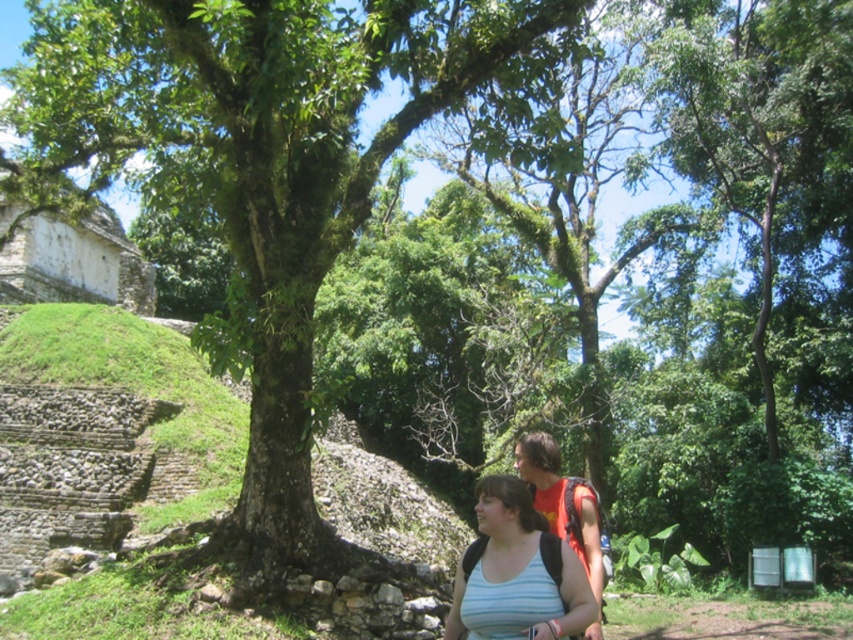
Does green leafy tree at center have a greater width compared to light blue striped tank top at center?

Indeed, green leafy tree at center has a greater width compared to light blue striped tank top at center.

Does point (32, 179) come in front of point (581, 566)?

No, it is not.

At what (x,y) coordinates should I click in order to perform the action: click on green leafy tree at center. Please return your answer as a coordinate pair (x, y). This screenshot has height=640, width=853. Looking at the image, I should click on (258, 170).

The width and height of the screenshot is (853, 640). Describe the element at coordinates (515, 572) in the screenshot. I see `light blue striped tank top at center` at that location.

Who is positioned more to the left, light blue striped tank top at center or white stone amphitheater at upper left?

white stone amphitheater at upper left

Consider the image. Who is more distant from viewer, (505,611) or (4,260)?

The point (4,260) is more distant.

I want to click on light blue striped tank top at center, so click(x=515, y=572).

Does point (277, 428) lie behind point (86, 227)?

No.

Which is more to the left, green leafy tree at center or white stone amphitheater at upper left?

Positioned to the left is white stone amphitheater at upper left.

Is point (323, 188) behind point (131, 284)?

No.

Locate an element on the screen. This screenshot has height=640, width=853. green leafy tree at center is located at coordinates (258, 170).